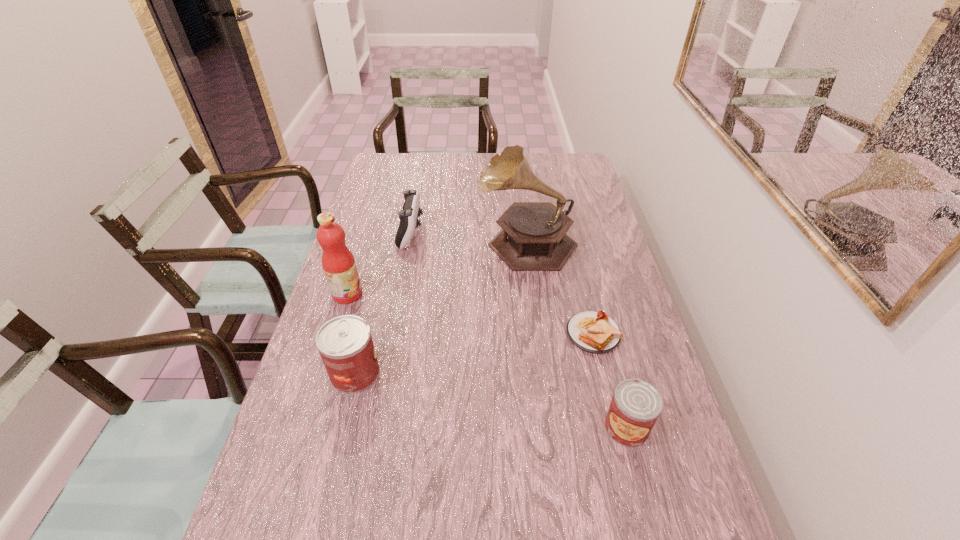
At what (x,y) coordinates should I click in order to perform the action: click on the taller can. Please return your answer as a coordinate pair (x, y). The height and width of the screenshot is (540, 960). Looking at the image, I should click on (345, 344).

Image resolution: width=960 pixels, height=540 pixels. In order to click on the left can in this screenshot , I will do `click(345, 344)`.

Image resolution: width=960 pixels, height=540 pixels. Identify the location of the nearer can. (636, 405).

The height and width of the screenshot is (540, 960). In order to click on the right can in this screenshot , I will do `click(636, 405)`.

Where is `phonograph record`? This screenshot has height=540, width=960. phonograph record is located at coordinates (533, 237).

The width and height of the screenshot is (960, 540). Find the location of `control`. control is located at coordinates (410, 211).

Identify the location of the fourth nearest object. The height and width of the screenshot is (540, 960). (338, 263).

Locate an element on the screen. This screenshot has width=960, height=540. sandwich is located at coordinates (594, 332).

At what (x,y) coordinates should I click in order to perform the action: click on free space located 0.380m on the back of the taller can. Please return your answer as a coordinate pair (x, y). Looking at the image, I should click on (383, 259).

At what (x,y) coordinates should I click in order to perform the action: click on free space located on the back of the nearer can. Please return your answer as a coordinate pair (x, y). This screenshot has width=960, height=540. Looking at the image, I should click on (591, 294).